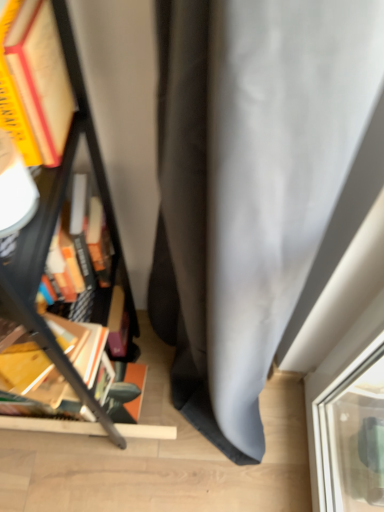
Question: Is matte black bookcase at left at the back of wooden book at left?

Choices:
 (A) yes
 (B) no

Answer: (A)

Question: Is the depth of wooden book at left greater than that of matte black bookcase at left?

Choices:
 (A) yes
 (B) no

Answer: (A)

Question: Would you say wooden book at left is outside matte black bookcase at left?

Choices:
 (A) yes
 (B) no

Answer: (B)

Question: Does wooden book at left appear on the left side of matte black bookcase at left?

Choices:
 (A) yes
 (B) no

Answer: (B)

Question: From the image's perspective, would you say wooden book at left is shown under matte black bookcase at left?

Choices:
 (A) no
 (B) yes

Answer: (B)

Question: Could you tell me if wooden book at left is facing matte black bookcase at left?

Choices:
 (A) no
 (B) yes

Answer: (B)

Question: Can you confirm if matte black bookcase at left is positioned to the right of wooden book at left?

Choices:
 (A) yes
 (B) no

Answer: (B)

Question: Is matte black bookcase at left looking in the opposite direction of wooden book at left?

Choices:
 (A) no
 (B) yes

Answer: (B)

Question: Considering the relative sizes of matte black bookcase at left and wooden book at left in the image provided, is matte black bookcase at left bigger than wooden book at left?

Choices:
 (A) no
 (B) yes

Answer: (B)

Question: Does matte black bookcase at left have a greater width compared to wooden book at left?

Choices:
 (A) yes
 (B) no

Answer: (A)

Question: Is matte black bookcase at left in front of wooden book at left?

Choices:
 (A) yes
 (B) no

Answer: (A)

Question: From the image's perspective, is matte black bookcase at left located beneath wooden book at left?

Choices:
 (A) no
 (B) yes

Answer: (A)

Question: From a real-world perspective, is matte black bookcase at left positioned above or below wooden book at left?

Choices:
 (A) above
 (B) below

Answer: (B)